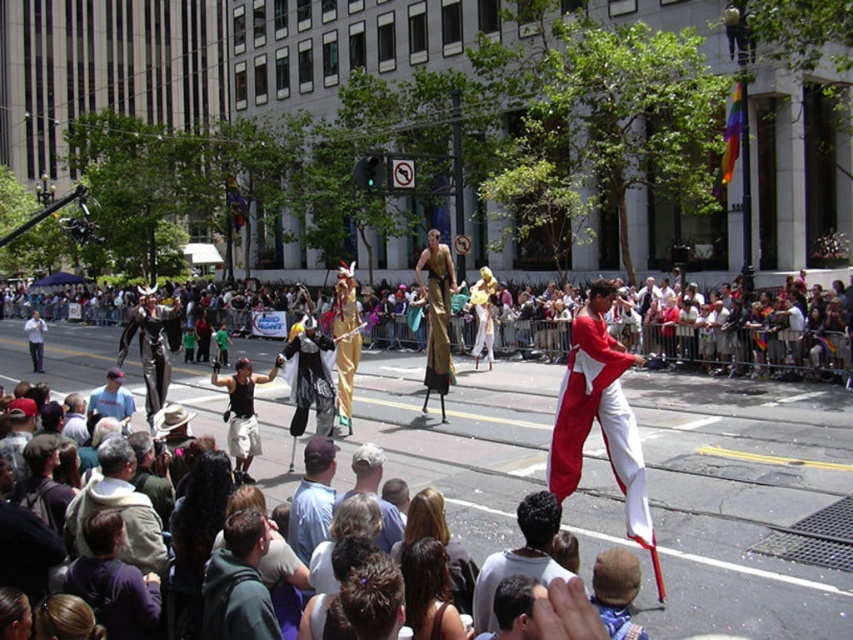
Consider the image. You are a photographer standing at the center of the street. You want to capture the dark brown hair at lower center in your photo. Where should you position your camera to ensure it is in the frame?

The dark brown hair at lower center is located at point 0.870 on the x axis and 0.611 on the y axis, so you should position your camera to include this coordinate in the frame to capture it.

You are a photographer standing at the edge of the barricade. You want to take a photo of both the dark gray hoodie at lower left and the light blue cotton shirt at center in the same frame. Given that your camera has a maximum focus range of 1.2 meters, will you be able to capture both subjects clearly in one shot?

The dark gray hoodie at lower left and light blue cotton shirt at center are 1.31 meters apart from each other. Since the distance between them exceeds the camera maximum focus range of 1.2 meters, you cannot capture both subjects clearly in one shot.